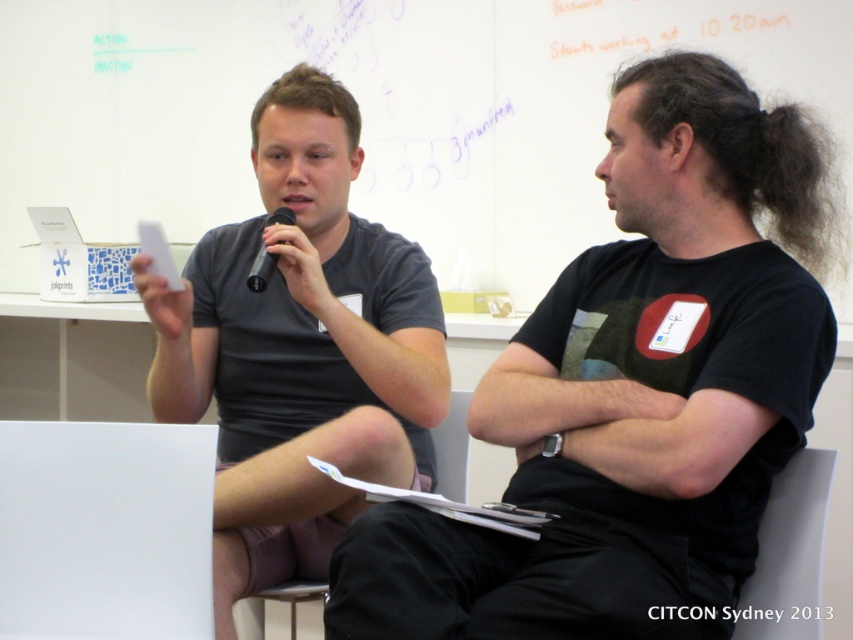
You are standing in the conference room and want to determine which of the two points, point (x=601, y=480) or point (x=792, y=596), is closer to you. Based on the image, which point is nearer?

Point (x=601, y=480) is closer to the camera than point (x=792, y=596), so it is the nearer point.

You are standing in the conference room and want to move from the point at coordinates point (517, 618) to the point at coordinates point (132, 531). Which direction should you move in to reach your destination?

To move from point (517, 618) to point (132, 531), you should move downward and to the left since point (132, 531) is located below and to the left of point (517, 618).